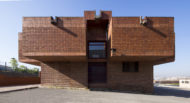
In order to click on floor in this screenshot , I will do `click(121, 101)`.